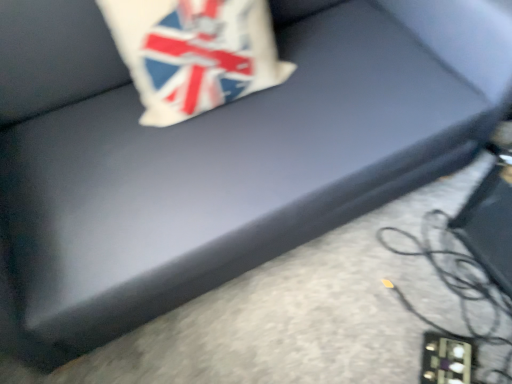
What is the approximate width of white fabric pillow at upper left?

white fabric pillow at upper left is 10.08 inches in width.

At what (x,y) coordinates should I click in order to perform the action: click on white fabric pillow at upper left. Please return your answer as a coordinate pair (x, y). Looking at the image, I should click on (194, 53).

Describe the element at coordinates (194, 53) in the screenshot. I see `white fabric pillow at upper left` at that location.

Based on the photo, measure the distance between white fabric pillow at upper left and camera.

The distance of white fabric pillow at upper left from camera is 35.93 inches.

In order to face white fabric pillow at upper left, should I rotate leftwards or rightwards?

You should rotate left by 7.102 degrees.

Locate an element on the screen. white fabric pillow at upper left is located at coordinates (194, 53).